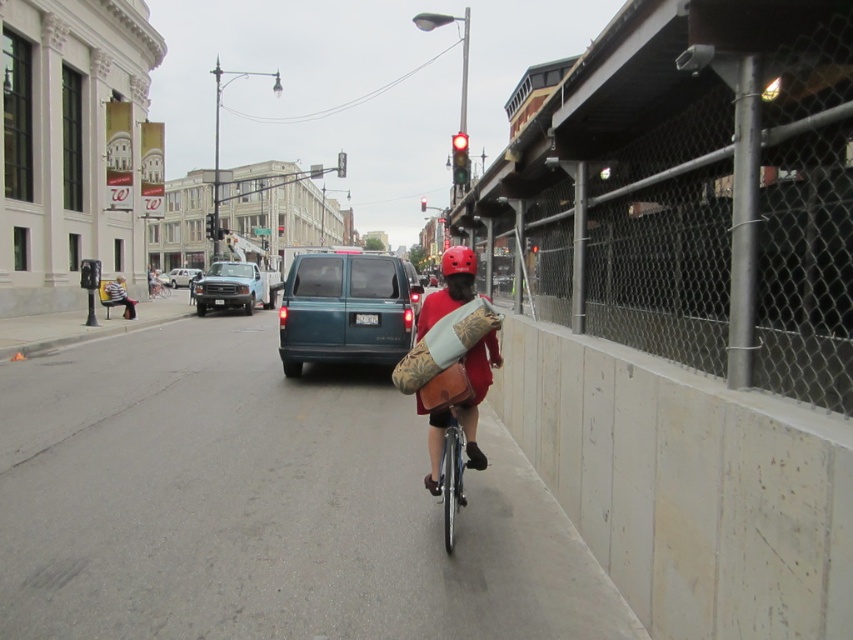
Question: Which object is closer to the camera taking this photo?

Choices:
 (A) smooth concrete bike lane at center
 (B) white matte van at center
 (C) teal matte van at center
 (D) red matte helmet at upper center

Answer: (A)

Question: Is matte blue truck at center smaller than white matte van at center?

Choices:
 (A) no
 (B) yes

Answer: (B)

Question: Is smooth concrete bike lane at center bigger than white matte van at center?

Choices:
 (A) yes
 (B) no

Answer: (B)

Question: Among these points, which one is farthest from the camera?

Choices:
 (A) [x=155, y=280]
 (B) [x=172, y=288]
 (C) [x=393, y=323]

Answer: (B)

Question: Where is teal matte van at center located in relation to white matte van at center in the image?

Choices:
 (A) above
 (B) below

Answer: (B)

Question: Which object is closer to the camera taking this photo?

Choices:
 (A) yellow fabric bag at left
 (B) teal matte van at center

Answer: (B)